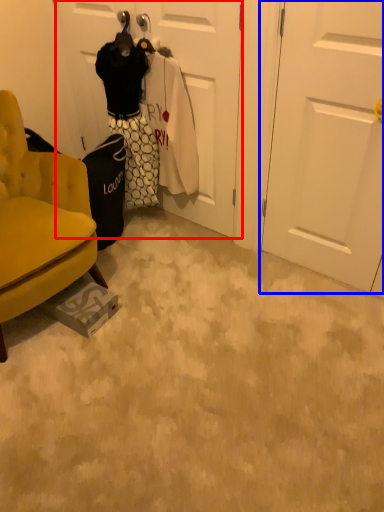
Question: Which object appears closest to the camera in this image, door (highlighted by a red box) or door (highlighted by a blue box)?

Choices:
 (A) door
 (B) door

Answer: (B)